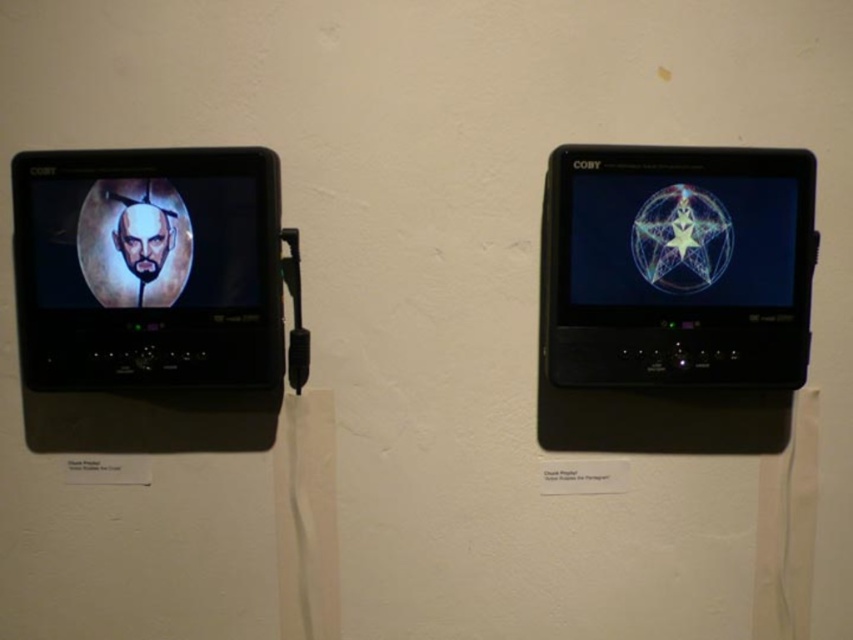
Is matte black smartphone at right taller than matte black monitor at left?

Incorrect, matte black smartphone at right's height is not larger of matte black monitor at left's.

Between point (671, 202) and point (149, 148), which one is positioned behind?

The point (149, 148) is behind.

You are a GUI agent. You are given a task and a screenshot of the screen. Output one action in this format:
    pyautogui.click(x=<x>, y=<y>)
    Task: Click on the matte black smartphone at right
    
    Given the screenshot: What is the action you would take?
    pyautogui.click(x=677, y=266)

Is matte black smartphone at right further to the viewer compared to transparent glass sphere at upper right?

No, it is not.

In the scene shown: Is matte black smartphone at right above transparent glass sphere at upper right?

No, matte black smartphone at right is not above transparent glass sphere at upper right.

Identify the location of matte black smartphone at right. coord(677,266).

Where is `matte black smartphone at right`? This screenshot has width=853, height=640. matte black smartphone at right is located at coordinates (677, 266).

Is transparent glass sphere at upper right bigger than matte black portrait at left?

Correct, transparent glass sphere at upper right is larger in size than matte black portrait at left.

Which is in front, point (630, 252) or point (207, 209)?

Point (207, 209) is in front.

Is point (608, 176) positioned before point (161, 276)?

Yes, point (608, 176) is in front of point (161, 276).

Identify the location of transparent glass sphere at upper right. [682, 241].